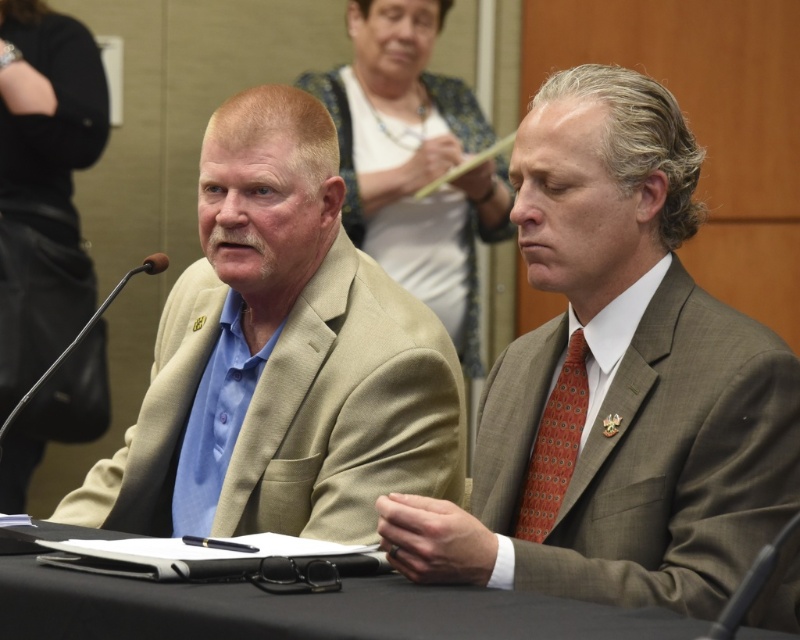
You are a photographer setting up for a formal event. You need to ensure that the matte brown suit at center and the black fabric table at center are both in frame. Given the camera lens you have, the maximum width it can capture is 1.2 meters. Can both objects fit within the frame if positioned side by side?

The matte brown suit at center has a lesser width compared to the black fabric table at center. However, since the combined width of both objects would exceed the camera lens maximum capture width of 1.2 meters, they cannot both fit within the frame when placed side by side.

You are a photographer setting up for a formal event. You need to position a camera to capture both the black fabric table at center and the orange dotted tie at right. Based on their positions, which object should be placed lower in the frame to ensure both are visible?

The black fabric table at center is located below the orange dotted tie at right, so to ensure both are visible in the frame, the table should be placed lower while the tie remains higher.

You are a photographer taking a picture of the beige fabric suit at left and the black fabric table at center. To ensure both are in frame, should you position your camera to the left or right of the table?

The beige fabric suit at left is to the left of the black fabric table at center. To include both in the frame, the camera should be positioned to the right of the table so that both the left side of the table and the suit are visible.